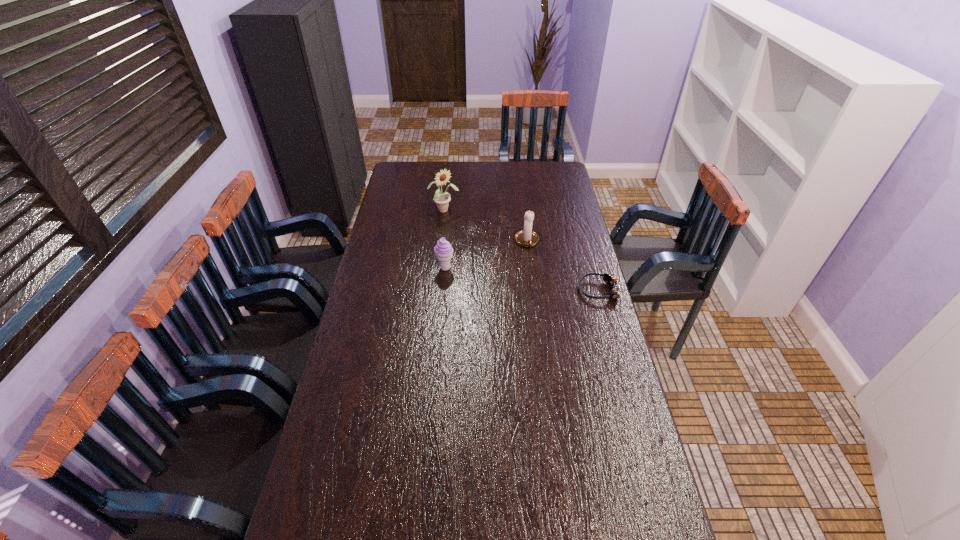
Identify the location of the third farthest object. The height and width of the screenshot is (540, 960). (443, 250).

At what (x,y) coordinates should I click in order to perform the action: click on the shortest object. Please return your answer as a coordinate pair (x, y). The image size is (960, 540). Looking at the image, I should click on click(611, 280).

Identify the location of goggles. (611, 280).

I want to click on the second object from right to left, so click(x=527, y=238).

Locate an element on the screen. the third nearest object is located at coordinates (527, 238).

Where is `sunflower`? sunflower is located at coordinates (442, 200).

Identify the location of the farthest object. (442, 200).

What are the coordinates of `vacant space located on the front of the second nearest object` in the screenshot? It's located at (442, 306).

Locate an element on the screen. Image resolution: width=960 pixels, height=540 pixels. free point located through the lenses of the goggles is located at coordinates 549,290.

You are a GUI agent. You are given a task and a screenshot of the screen. Output one action in this format:
    pyautogui.click(x=<x>, y=<y>)
    Task: Click on the blank space located 0.240m through the lenses of the goggles
    Image resolution: width=960 pixels, height=540 pixels.
    Given the screenshot: What is the action you would take?
    pyautogui.click(x=516, y=290)